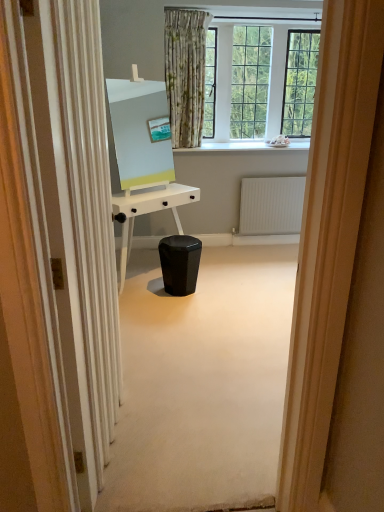
I want to click on free space in front of white textured radiator at center, so click(x=268, y=254).